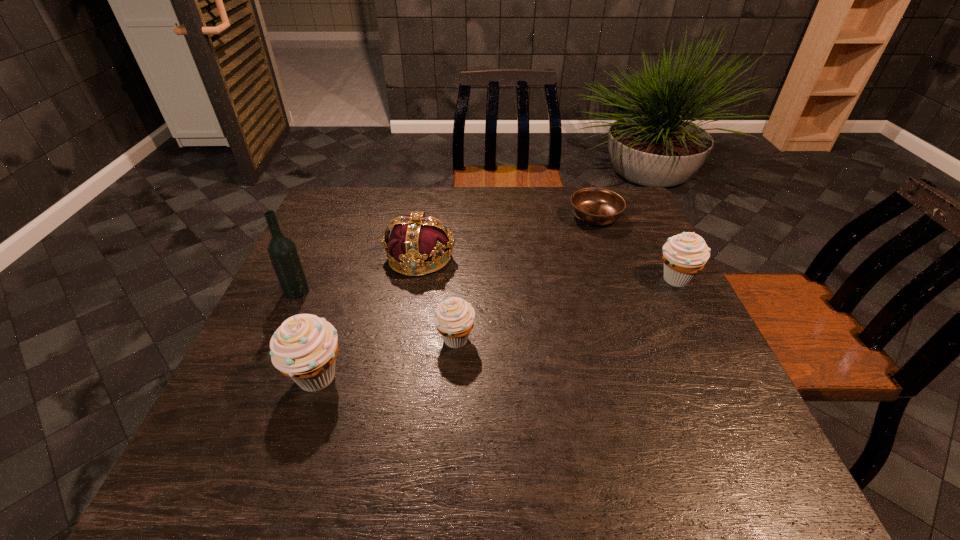
What are the coordinates of `free spot between the second muffin from left to right and the soup bowl` in the screenshot? It's located at (525, 278).

Where is `vacant region between the leftmost muffin and the rightmost muffin`? vacant region between the leftmost muffin and the rightmost muffin is located at coordinates (496, 328).

This screenshot has height=540, width=960. I want to click on free spot between the rightmost object and the leftmost object, so click(486, 285).

Where is `free space between the vodka and the crown`? The width and height of the screenshot is (960, 540). free space between the vodka and the crown is located at coordinates (358, 274).

You are a GUI agent. You are given a task and a screenshot of the screen. Output one action in this format:
    pyautogui.click(x=<x>, y=<y>)
    Task: Click on the unoccupied area between the second muffin from left to right and the farthest object
    
    Given the screenshot: What is the action you would take?
    pyautogui.click(x=525, y=278)

At what (x,y) coordinates should I click in order to perform the action: click on blank region between the farthest muffin and the crown. Please return your answer as a coordinate pair (x, y). The height and width of the screenshot is (540, 960). Looking at the image, I should click on (547, 268).

Where is `free point between the farthest object and the second muffin from right to left`? The height and width of the screenshot is (540, 960). free point between the farthest object and the second muffin from right to left is located at coordinates (525, 278).

This screenshot has height=540, width=960. Identify the location of object that is the closest to the leftmost muffin. (282, 251).

This screenshot has width=960, height=540. In order to click on object that is the second nearest to the fifth object from right to left in this screenshot , I will do `click(454, 318)`.

Identify which muffin is the second nearest to the second muffin from right to left. Please provide its 2D coordinates. Your answer should be formatted as a tuple, i.e. [(x, y)], where the tuple contains the x and y coordinates of a point satisfying the conditions above.

[(684, 255)]